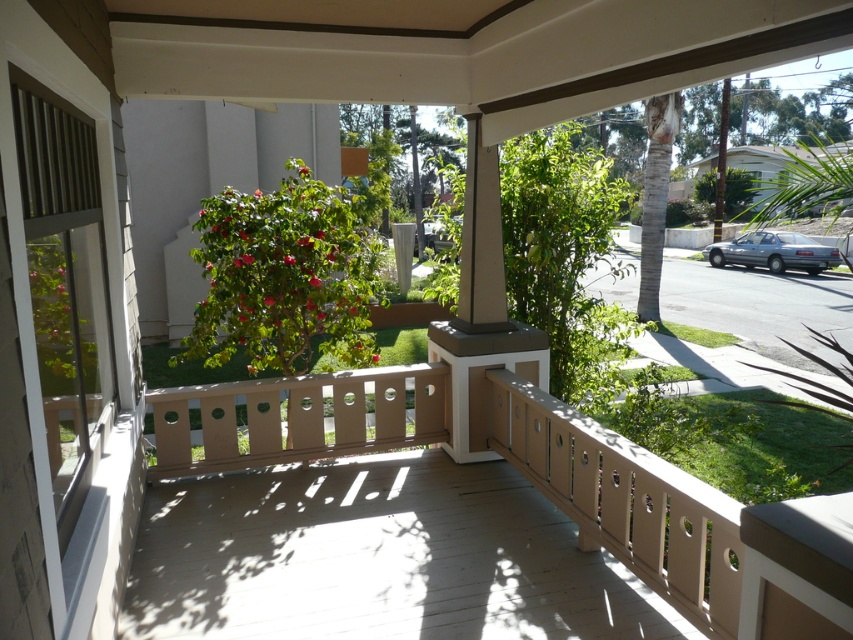
Can you confirm if green leafy bush at center is smaller than silver metallic sedan at right?

No.

Consider the image. Between green leafy bush at center and silver metallic sedan at right, which one is positioned higher?

silver metallic sedan at right

This screenshot has width=853, height=640. What do you see at coordinates (283, 276) in the screenshot? I see `green leafy bush at center` at bounding box center [283, 276].

Where is `green leafy bush at center`? This screenshot has width=853, height=640. green leafy bush at center is located at coordinates (283, 276).